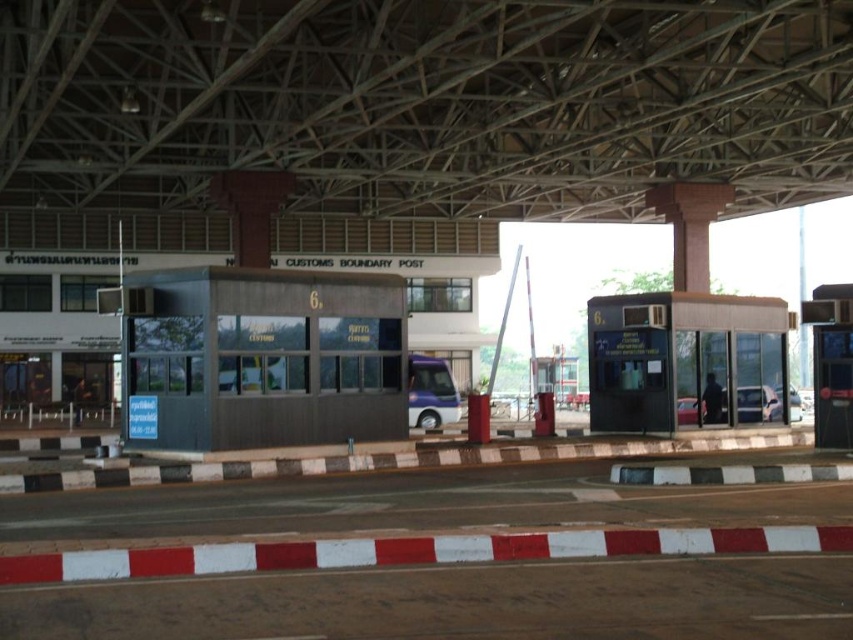
Between dark gray concrete bus station at center and matte black booth at right, which one has less height?

With less height is dark gray concrete bus station at center.

Between dark gray concrete bus station at center and matte black booth at right, which one has more height?

matte black booth at right is taller.

Which is behind, point (204, 392) or point (764, 305)?

Positioned behind is point (764, 305).

In order to click on dark gray concrete bus station at center in this screenshot , I will do pyautogui.click(x=263, y=356).

Can you confirm if matte black booth at right is positioned to the left of metallic purple bus at center?

Incorrect, matte black booth at right is not on the left side of metallic purple bus at center.

Is point (590, 346) behind point (436, 371)?

No, (590, 346) is in front of (436, 371).

At what (x,y) coordinates should I click in order to perform the action: click on matte black booth at right. Please return your answer as a coordinate pair (x, y). The width and height of the screenshot is (853, 640). Looking at the image, I should click on (685, 360).

Is dark gray concrete bus station at center taller than metallic purple bus at center?

No.

From the picture: Is dark gray concrete bus station at center bigger than metallic purple bus at center?

No, dark gray concrete bus station at center is not bigger than metallic purple bus at center.

Does point (399, 387) lie in front of point (436, 387)?

Yes, it is in front of point (436, 387).

In order to click on dark gray concrete bus station at center in this screenshot , I will do `click(263, 356)`.